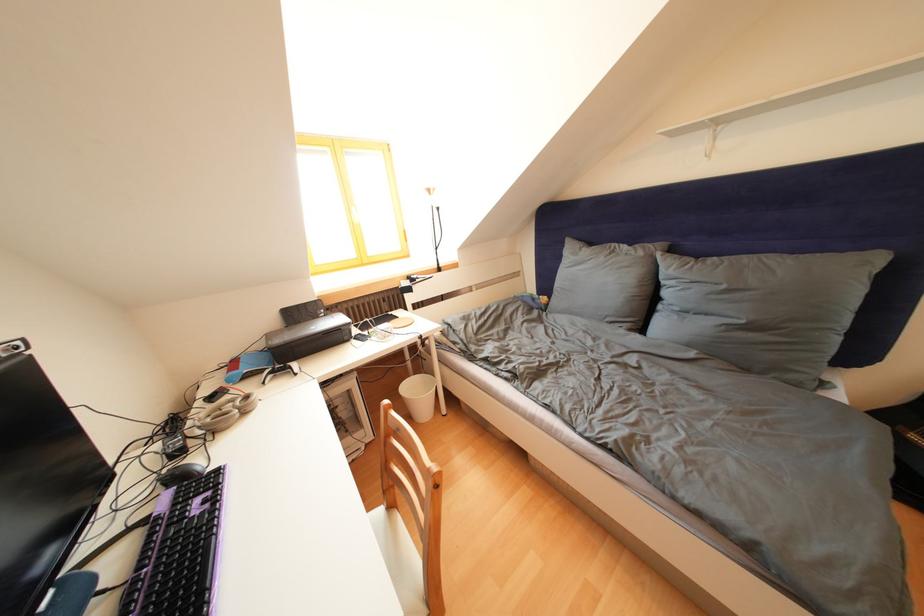
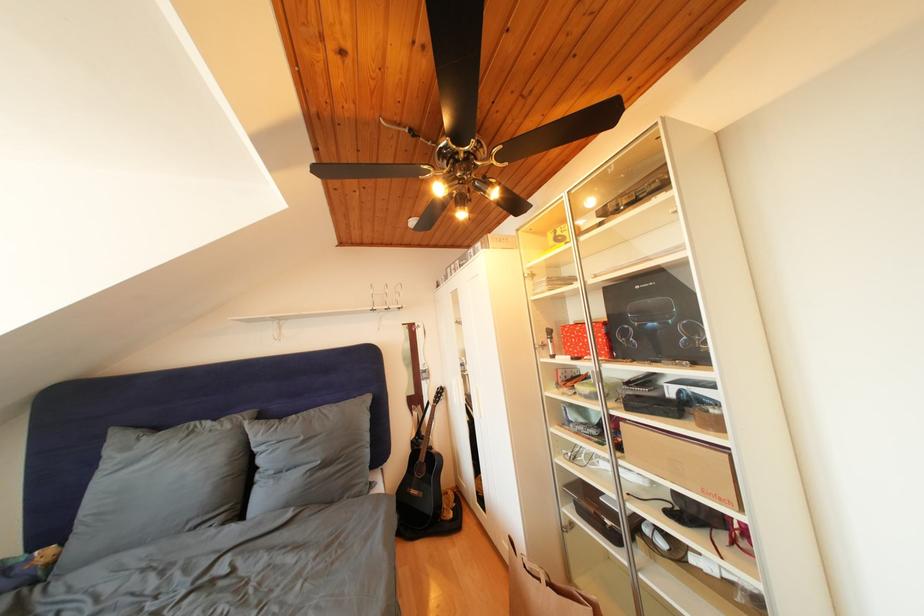
Locate, in the second image, the point that corresponds to pixel 649 259 in the first image.

(236, 432)